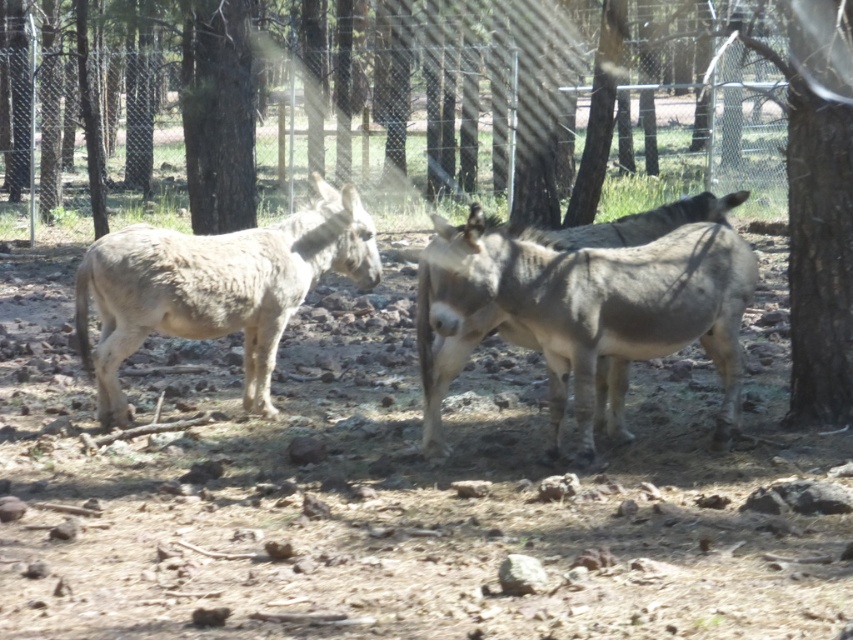
Question: Among these objects, which one is nearest to the camera?

Choices:
 (A) metallic wire fence at upper center
 (B) brown rough bark tree at right
 (C) gray rough fur mule at center
 (D) fuzzy gray mule at center

Answer: (C)

Question: Which point is farther to the camera?

Choices:
 (A) metallic wire fence at upper center
 (B) brown dirt field at center

Answer: (A)

Question: Which is nearer to the gray rough fur mule at center?

Choices:
 (A) brown dirt field at center
 (B) fuzzy gray mule at center

Answer: (A)

Question: Is gray rough fur mule at center thinner than fuzzy gray mule at center?

Choices:
 (A) yes
 (B) no

Answer: (A)

Question: Does brown dirt field at center have a larger size compared to brown rough bark tree at right?

Choices:
 (A) yes
 (B) no

Answer: (B)

Question: Is metallic wire fence at upper center to the right of brown rough bark tree at right from the viewer's perspective?

Choices:
 (A) no
 (B) yes

Answer: (A)